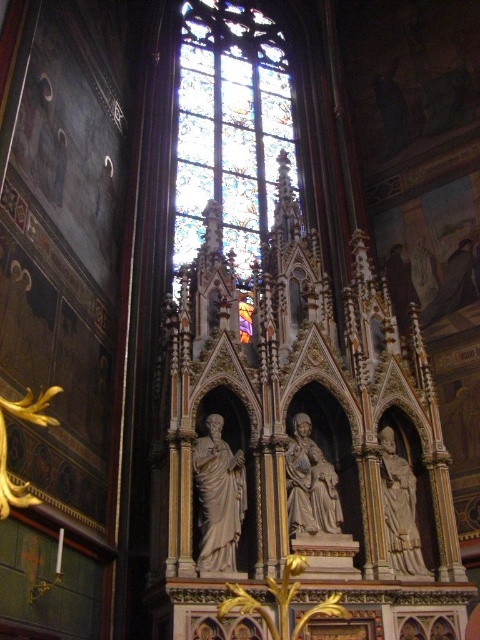
Where is `matte stone statue at center`? matte stone statue at center is located at coordinates (310, 483).

Is point (322, 472) in front of point (382, 435)?

Yes.

This screenshot has height=640, width=480. What do you see at coordinates (310, 483) in the screenshot?
I see `matte stone statue at center` at bounding box center [310, 483].

At what (x,y) coordinates should I click in order to perform the action: click on matte stone statue at center. Please return your answer as a coordinate pair (x, y). This screenshot has width=480, height=640. Looking at the image, I should click on (310, 483).

Does stained glass window at center have a lesser height compared to matte stone statue at center?

Incorrect, stained glass window at center's height does not fall short of matte stone statue at center's.

Which is more to the right, stained glass window at center or matte stone statue at center?

Positioned to the right is matte stone statue at center.

Who is more forward, (x=180, y=250) or (x=288, y=492)?

Point (x=288, y=492) is in front.

The image size is (480, 640). In order to click on stained glass window at center in this screenshot , I will do `click(229, 125)`.

How far apart are white marble statue at center and matte stone statue at center?

They are 5.46 meters apart.

Who is more forward, (228, 566) or (300, 432)?

Positioned in front is point (228, 566).

Locate an element on the screen. The image size is (480, 640). white marble statue at center is located at coordinates (218, 497).